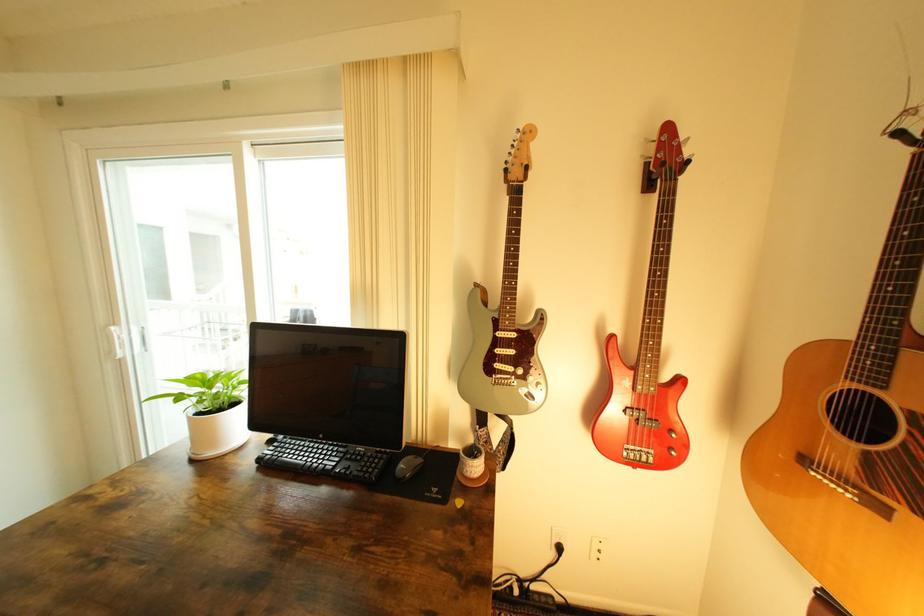
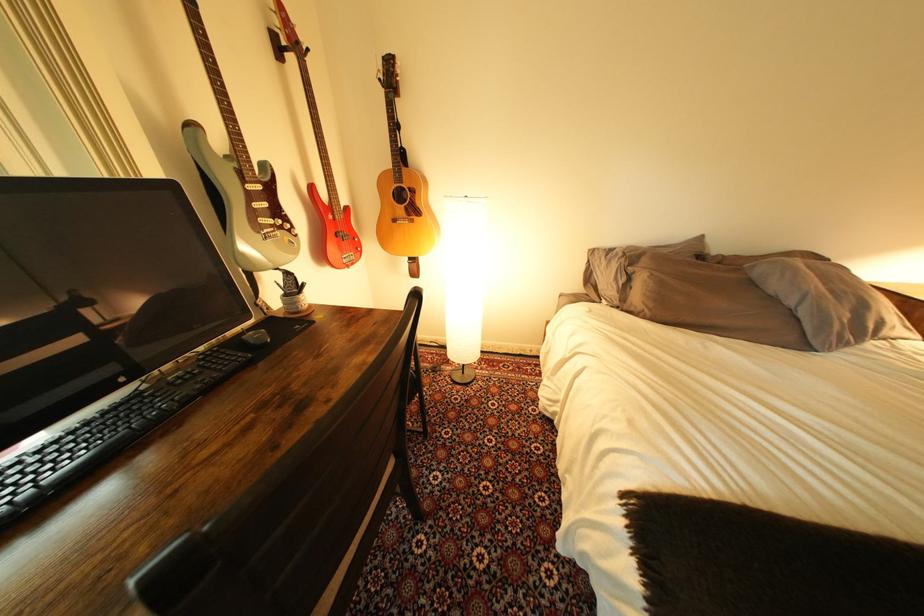
Based on the continuous images, in which direction is the camera rotating?

A: The rotation direction of the camera is right-down.